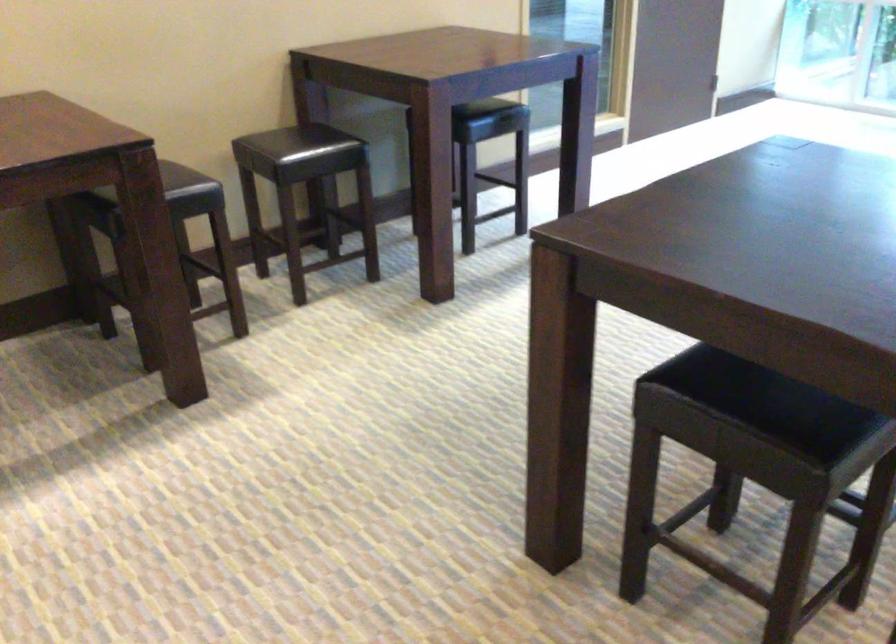
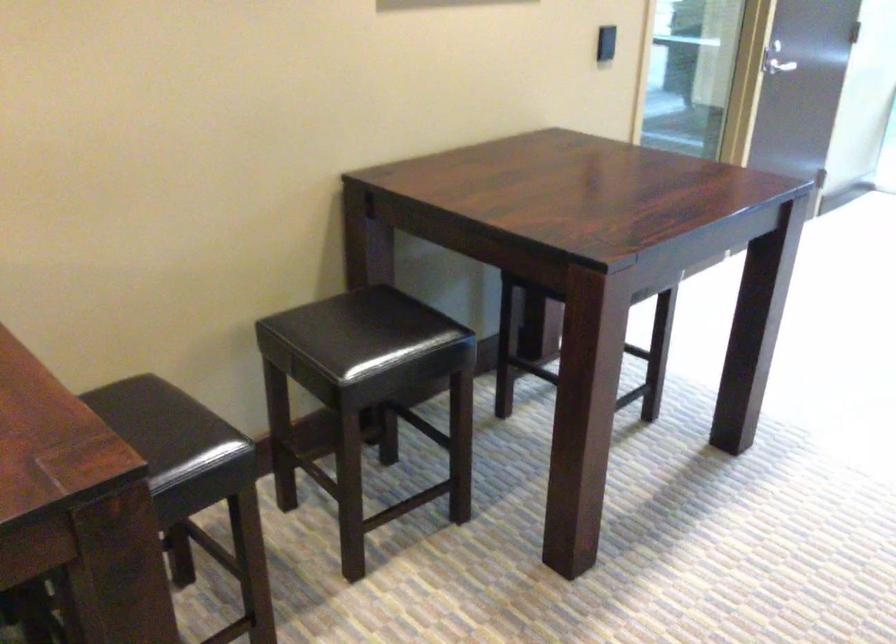
Which direction would the cameraman need to move to produce the second image?

The movement direction of the cameraman is left, forward.